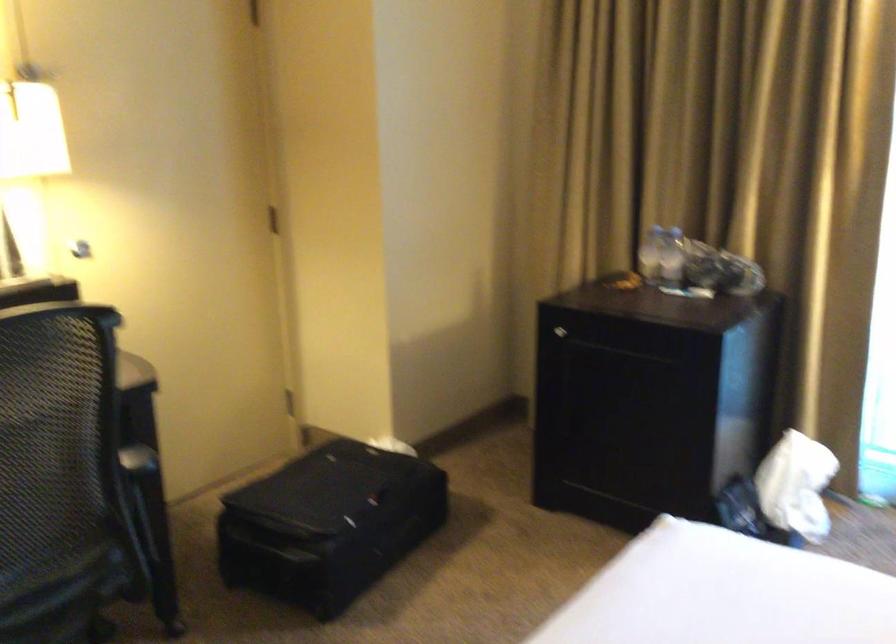
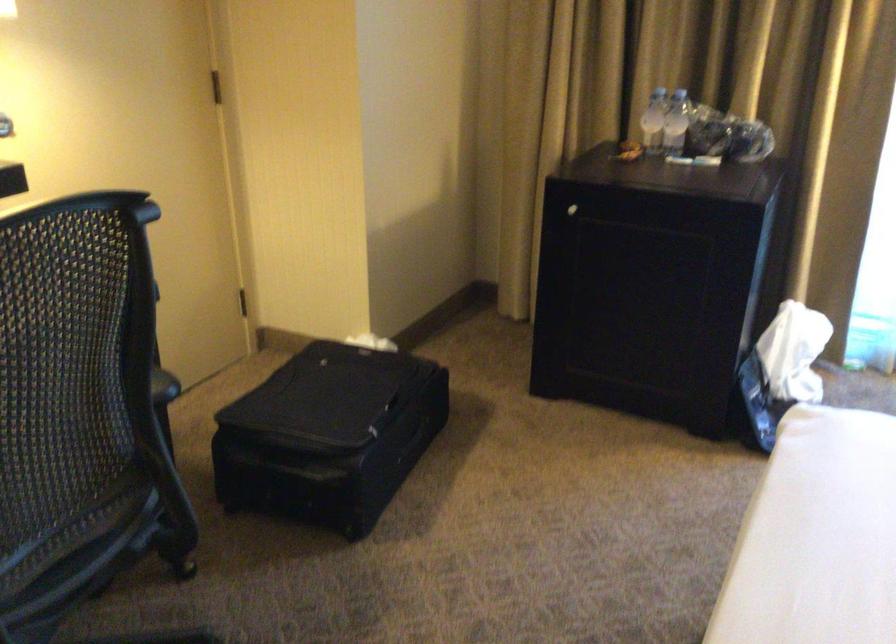
Locate, in the second image, the point that corresponds to (651,254) in the first image.

(653, 120)